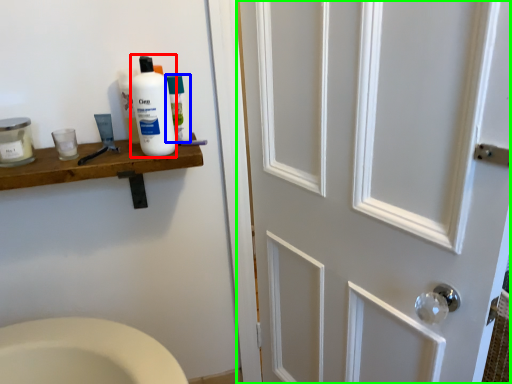
Question: Based on their relative distances, which object is farther from cleaning product (highlighted by a red box)? Choose from mouthwash (highlighted by a blue box) and door (highlighted by a green box).

Choices:
 (A) mouthwash
 (B) door

Answer: (B)